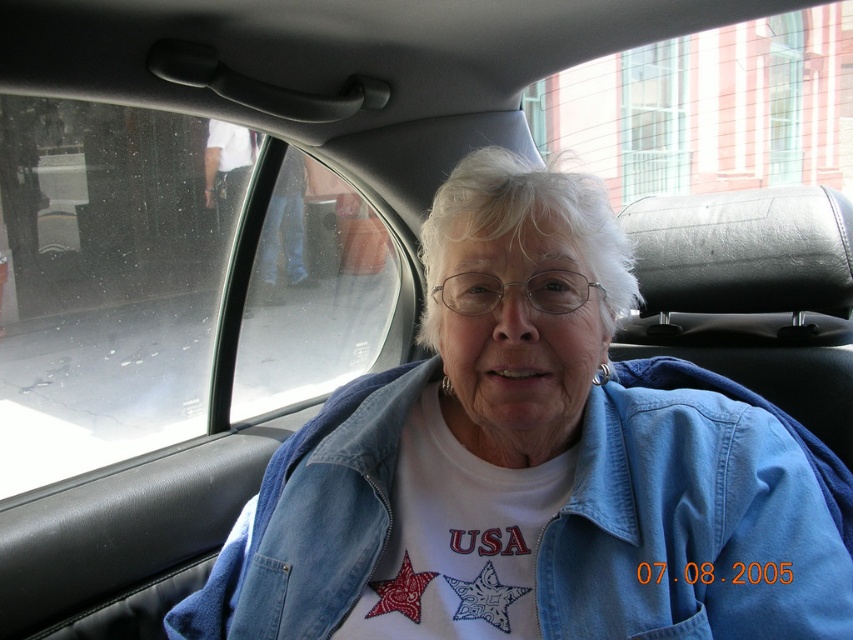
Consider the image. Which is below, transparent glass window at upper left or black leather headrest at upper right?

black leather headrest at upper right is below.

Does transparent glass window at upper left appear on the right side of black leather headrest at upper right?

→ Incorrect, transparent glass window at upper left is not on the right side of black leather headrest at upper right.

You are a GUI agent. You are given a task and a screenshot of the screen. Output one action in this format:
    pyautogui.click(x=<x>, y=<y>)
    Task: Click on the transparent glass window at upper left
    
    Given the screenshot: What is the action you would take?
    pyautogui.click(x=109, y=280)

Does transparent glass window at upper left have a larger size compared to denim jacket at lower right?

Yes, transparent glass window at upper left is bigger than denim jacket at lower right.

Does transparent glass window at upper left have a smaller size compared to denim jacket at lower right?

Incorrect, transparent glass window at upper left is not smaller in size than denim jacket at lower right.

You are a GUI agent. You are given a task and a screenshot of the screen. Output one action in this format:
    pyautogui.click(x=<x>, y=<y>)
    Task: Click on the transparent glass window at upper left
    The image size is (853, 640).
    Given the screenshot: What is the action you would take?
    pyautogui.click(x=109, y=280)

Locate an element on the screen. transparent glass window at upper left is located at coordinates (109, 280).

Which is more to the right, denim jacket at lower right or black leather headrest at upper right?

black leather headrest at upper right is more to the right.

This screenshot has width=853, height=640. I want to click on denim jacket at lower right, so (x=685, y=515).

Locate an element on the screen. The image size is (853, 640). denim jacket at lower right is located at coordinates (685, 515).